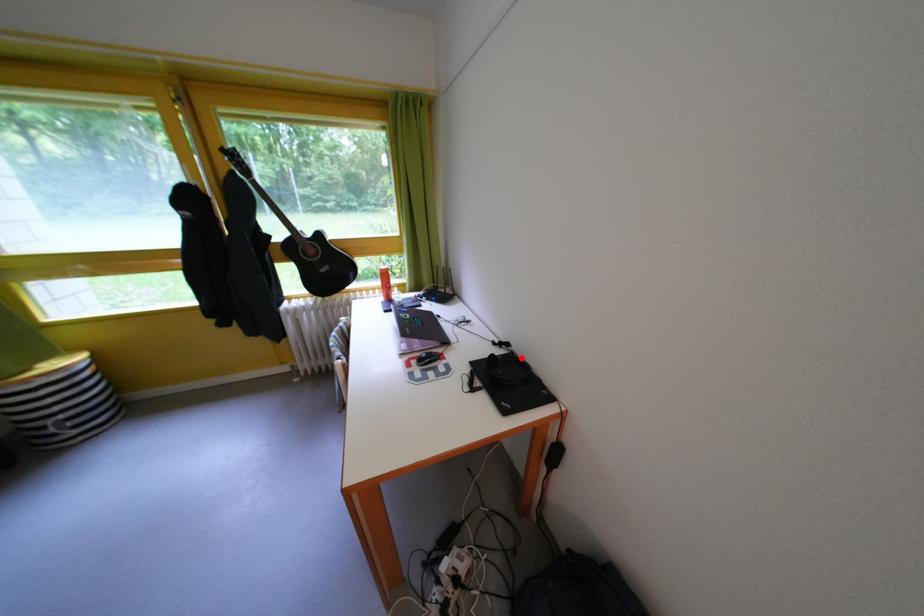
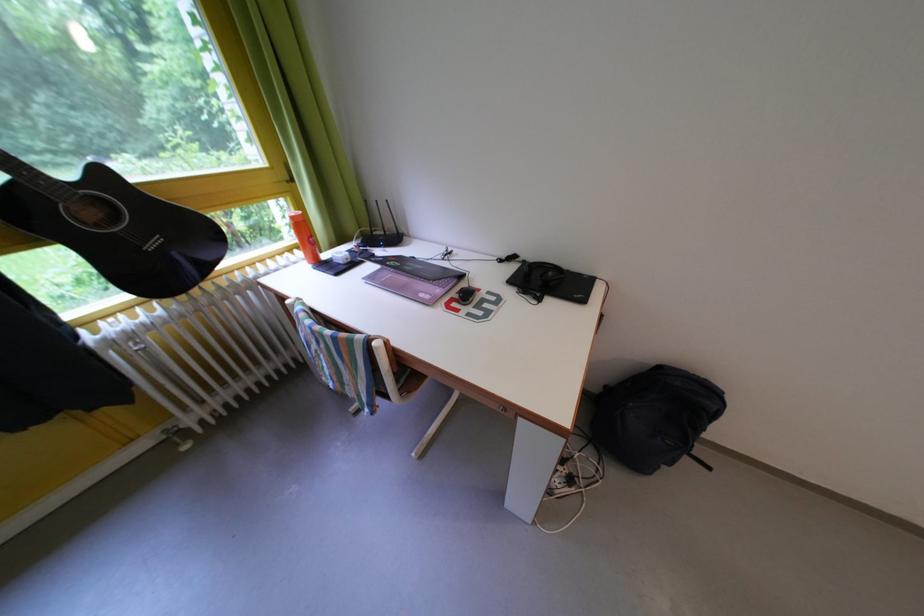
Find the pixel in the second image that matches the highlighted location in the first image.

(533, 267)